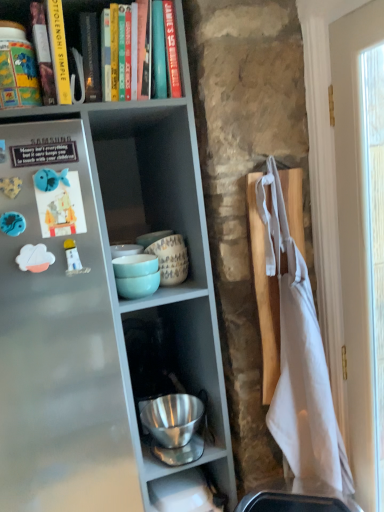
Question: From a real-world perspective, is hardcover book at upper left physically located above or below metallic gray shelf at upper left?

Choices:
 (A) above
 (B) below

Answer: (A)

Question: Choose the correct answer: Is hardcover book at upper left inside metallic gray shelf at upper left or outside it?

Choices:
 (A) inside
 (B) outside

Answer: (A)

Question: In terms of height, does hardcover book at upper left look taller or shorter compared to metallic gray shelf at upper left?

Choices:
 (A) short
 (B) tall

Answer: (A)

Question: Is metallic gray shelf at upper left in front of or behind hardcover book at upper left in the image?

Choices:
 (A) behind
 (B) front

Answer: (B)

Question: Is metallic gray shelf at upper left wider or thinner than hardcover book at upper left?

Choices:
 (A) wide
 (B) thin

Answer: (A)

Question: From their relative heights in the image, would you say metallic gray shelf at upper left is taller or shorter than hardcover book at upper left?

Choices:
 (A) short
 (B) tall

Answer: (B)

Question: Is point (134, 478) positioned closer to the camera than point (61, 20)?

Choices:
 (A) closer
 (B) farther

Answer: (B)